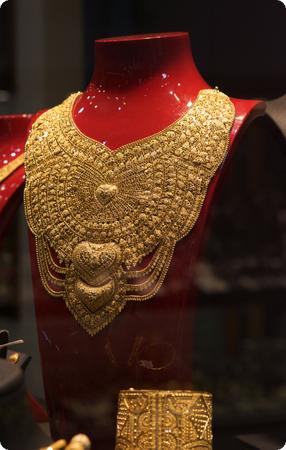
Identify the location of glass window. (209, 314).